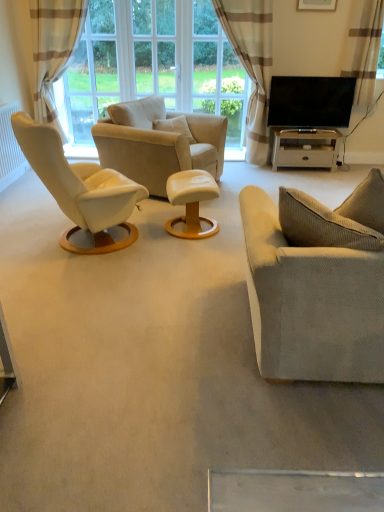
Question: Is point (1, 156) closer or farther from the camera than point (369, 99)?

Choices:
 (A) farther
 (B) closer

Answer: (B)

Question: In terms of size, does white matte radiator at left appear bigger or smaller than brown textured curtain at upper right, which is the first curtain in right-to-left order?

Choices:
 (A) small
 (B) big

Answer: (B)

Question: Which of these objects is positioned farthest from the white matte radiator at left?

Choices:
 (A) black glossy tv at upper right
 (B) clear glass window at center, placed as the 3th window screen when sorted from left to right
 (C) beige corduroy couch at right
 (D) transparent glass window at center, the 2th window screen viewed from the left
 (E) matte white picture frame at upper center

Answer: (E)

Question: Which object is the closest to the matte white picture frame at upper center?

Choices:
 (A) white matte radiator at left
 (B) beige striped curtain at left, which is counted as the 3th curtain, starting from the right
 (C) transparent glass window at center, marked as the 2th window screen in a right-to-left arrangement
 (D) white glossy table at lower right, the second table positioned from the bottom
 (E) beige fabric armchair at center

Answer: (D)